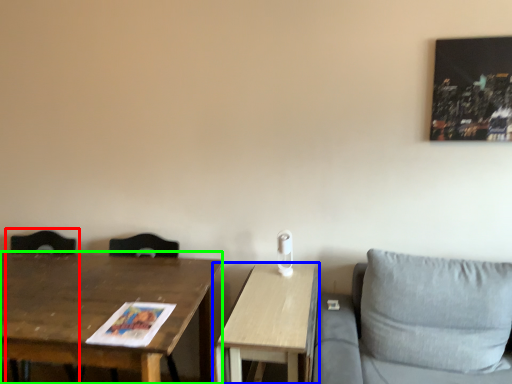
Question: Based on their relative distances, which object is farther from swivel chair (highlighted by a red box)? Choose from table (highlighted by a blue box) and table (highlighted by a green box).

Choices:
 (A) table
 (B) table

Answer: (A)